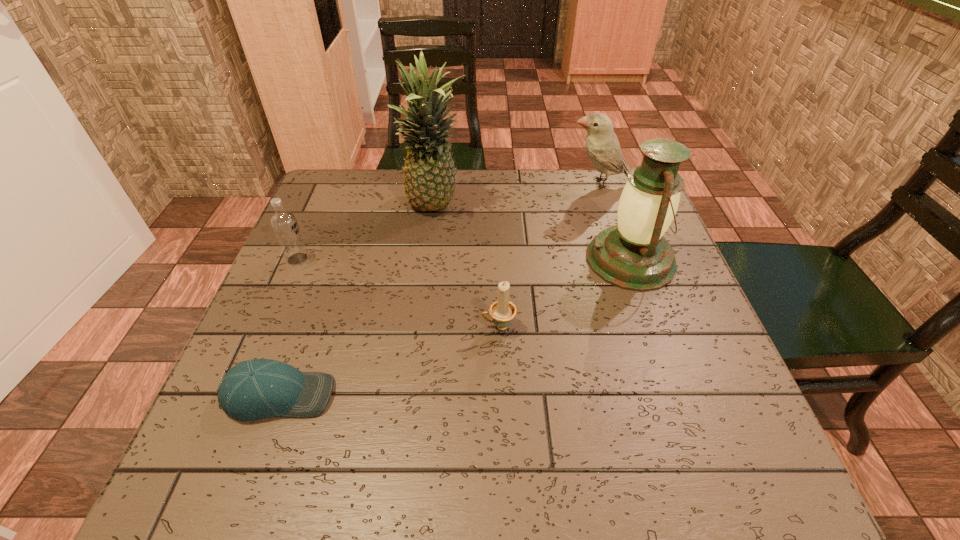
The width and height of the screenshot is (960, 540). I want to click on free space between the candle_holder and the third tallest object, so click(548, 255).

Identify the location of free space between the pineapple and the lantern. The height and width of the screenshot is (540, 960). (533, 233).

The image size is (960, 540). Find the location of `vacant space that's between the lantern and the pineapple`. vacant space that's between the lantern and the pineapple is located at coordinates (533, 233).

You are a GUI agent. You are given a task and a screenshot of the screen. Output one action in this format:
    pyautogui.click(x=<x>, y=<y>)
    Task: Click on the free space between the pineapple and the vodka
    This screenshot has width=960, height=540.
    Given the screenshot: What is the action you would take?
    pyautogui.click(x=367, y=233)

You are a GUI agent. You are given a task and a screenshot of the screen. Output one action in this format:
    pyautogui.click(x=<x>, y=<y>)
    Task: Click on the object that is the fifth closest to the vodka
    This screenshot has width=960, height=540.
    Given the screenshot: What is the action you would take?
    pyautogui.click(x=602, y=145)

Locate which object ranks in proximity to the third shortest object. Please provide its 2D coordinates. Your answer should be formatted as a tuple, i.e. [(x, y)], where the tuple contains the x and y coordinates of a point satisfying the conditions above.

[(429, 181)]

Locate an element on the screen. The image size is (960, 540). vacant region that satisfies the following two spatial constraints: 1. at the face of the fourth shortest object; 2. on the front side of the shortest object is located at coordinates (670, 395).

Where is `vacant space that satisfies the following two spatial constraints: 1. on the back side of the pineapple; 2. on the right side of the baseball cap`? The height and width of the screenshot is (540, 960). vacant space that satisfies the following two spatial constraints: 1. on the back side of the pineapple; 2. on the right side of the baseball cap is located at coordinates (347, 207).

Find the location of `vacant space that satisfies the following two spatial constraints: 1. on the front label of the baseball cap; 2. on the left side of the fourth tallest object`. vacant space that satisfies the following two spatial constraints: 1. on the front label of the baseball cap; 2. on the left side of the fourth tallest object is located at coordinates (239, 395).

Locate an element on the screen. The height and width of the screenshot is (540, 960). free space that satisfies the following two spatial constraints: 1. on the front label of the fourth tallest object; 2. on the left side of the baseball cap is located at coordinates (239, 395).